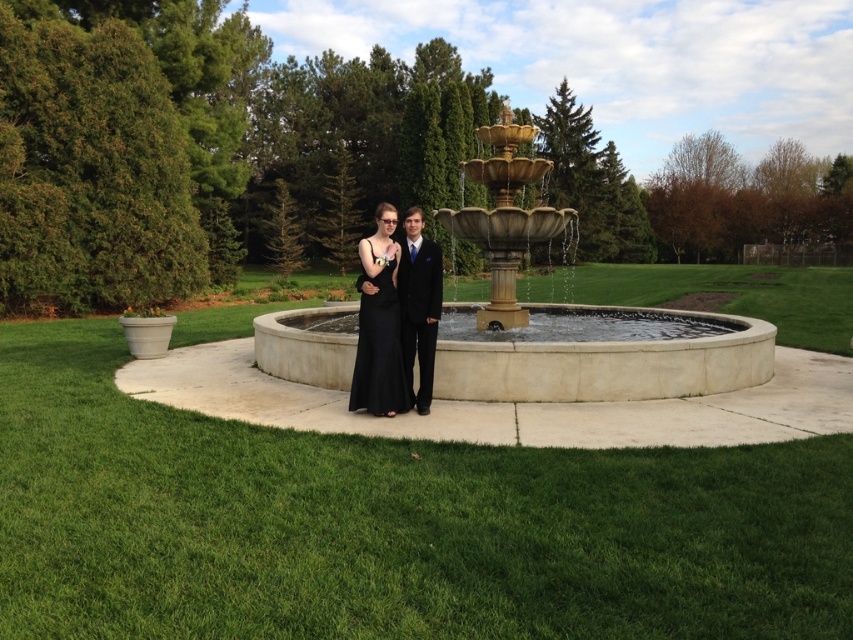
Image resolution: width=853 pixels, height=640 pixels. In order to click on gold polished stone fountain at center in this screenshot , I will do `click(576, 316)`.

Which of these two, gold polished stone fountain at center or shiny black suit at center, stands taller?

gold polished stone fountain at center

The image size is (853, 640). Describe the element at coordinates (576, 316) in the screenshot. I see `gold polished stone fountain at center` at that location.

Find the location of a particular element. The height and width of the screenshot is (640, 853). gold polished stone fountain at center is located at coordinates (576, 316).

Can you confirm if shiny black suit at center is positioned above black satin dress at center?

No.

Does shiny black suit at center have a greater height compared to black satin dress at center?

No.

Where is `shiny black suit at center`? shiny black suit at center is located at coordinates (418, 305).

Where is `shiny black suit at center`? shiny black suit at center is located at coordinates (418, 305).

Who is positioned more to the left, gold polished stone fountain at center or black satin dress at center?

From the viewer's perspective, black satin dress at center appears more on the left side.

Does gold polished stone fountain at center appear on the right side of black satin dress at center?

Yes, gold polished stone fountain at center is to the right of black satin dress at center.

What do you see at coordinates (576, 316) in the screenshot? I see `gold polished stone fountain at center` at bounding box center [576, 316].

This screenshot has width=853, height=640. I want to click on gold polished stone fountain at center, so click(x=576, y=316).